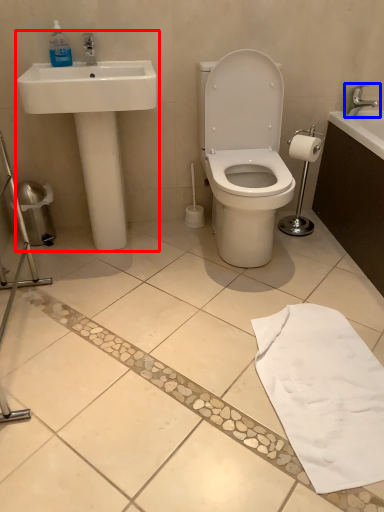
Question: Which of the following is the closest to the observer, sink (highlighted by a red box) or tap (highlighted by a blue box)?

Choices:
 (A) sink
 (B) tap

Answer: (A)